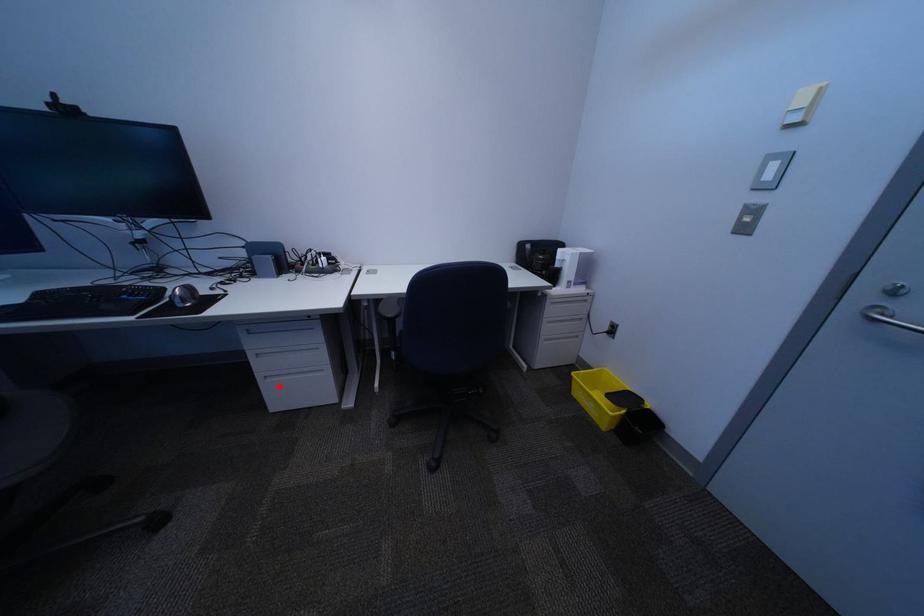
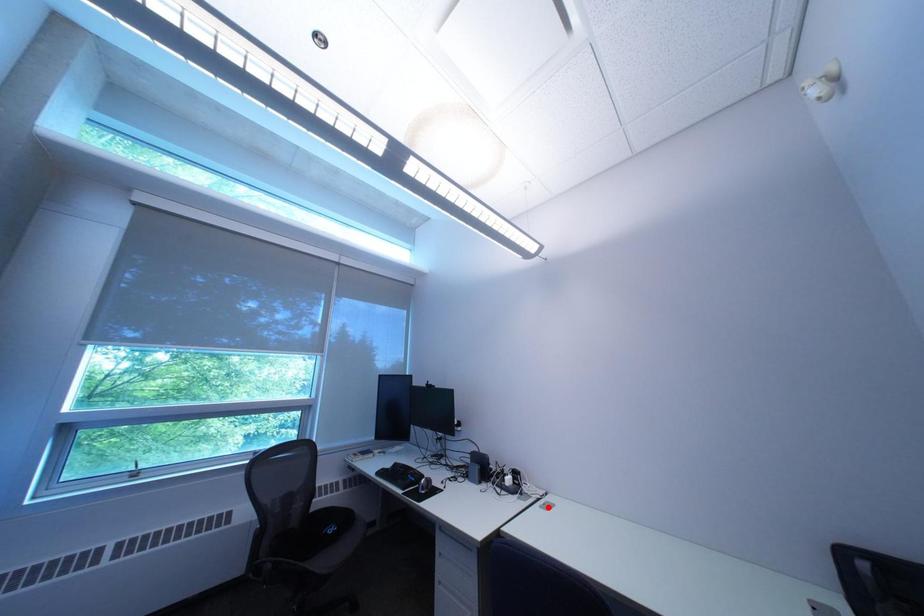
I am providing you with two images of the same scene from different viewpoints. A red point is marked on the first image and another point is marked on the second image. Do the highlighted points in image1 and image2 indicate the same real-world spot?

No